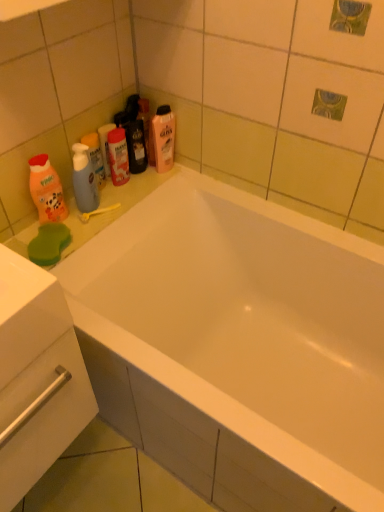
Find the location of a particular element. free space to the back side of yellow plastic toothbrush at upper left is located at coordinates (124, 187).